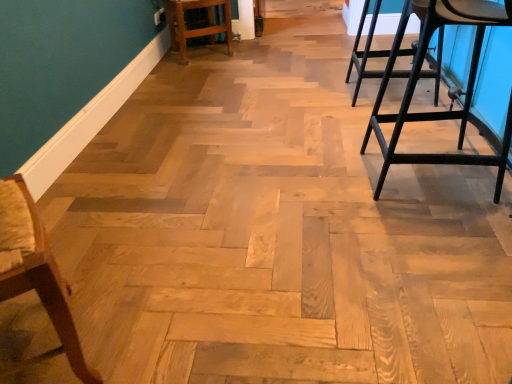
Question: From the image's perspective, is light brown wood bar stool at center under wooden chair at left?

Choices:
 (A) yes
 (B) no

Answer: (B)

Question: Is light brown wood bar stool at center not within wooden chair at left?

Choices:
 (A) no
 (B) yes

Answer: (B)

Question: Can you confirm if light brown wood bar stool at center is bigger than wooden chair at left?

Choices:
 (A) yes
 (B) no

Answer: (A)

Question: From the image's perspective, would you say light brown wood bar stool at center is positioned over wooden chair at left?

Choices:
 (A) yes
 (B) no

Answer: (A)

Question: Is light brown wood bar stool at center taller than wooden chair at left?

Choices:
 (A) yes
 (B) no

Answer: (B)

Question: Is light brown wood bar stool at center oriented away from wooden chair at left?

Choices:
 (A) no
 (B) yes

Answer: (A)

Question: Is light brown wood bar stool at center completely or partially inside wooden chair at left?

Choices:
 (A) yes
 (B) no

Answer: (B)

Question: From a real-world perspective, is wooden chair at left beneath light brown wood bar stool at center?

Choices:
 (A) no
 (B) yes

Answer: (A)

Question: Considering the relative sizes of wooden chair at left and light brown wood bar stool at center in the image provided, is wooden chair at left taller than light brown wood bar stool at center?

Choices:
 (A) yes
 (B) no

Answer: (A)

Question: Is wooden chair at left thinner than light brown wood bar stool at center?

Choices:
 (A) yes
 (B) no

Answer: (A)

Question: Is light brown wood bar stool at center at the back of wooden chair at left?

Choices:
 (A) yes
 (B) no

Answer: (B)

Question: Considering the relative sizes of wooden chair at left and light brown wood bar stool at center in the image provided, is wooden chair at left bigger than light brown wood bar stool at center?

Choices:
 (A) yes
 (B) no

Answer: (B)

Question: Considering the positions of light brown wood bar stool at center and wooden chair at left in the image, is light brown wood bar stool at center taller or shorter than wooden chair at left?

Choices:
 (A) tall
 (B) short

Answer: (B)